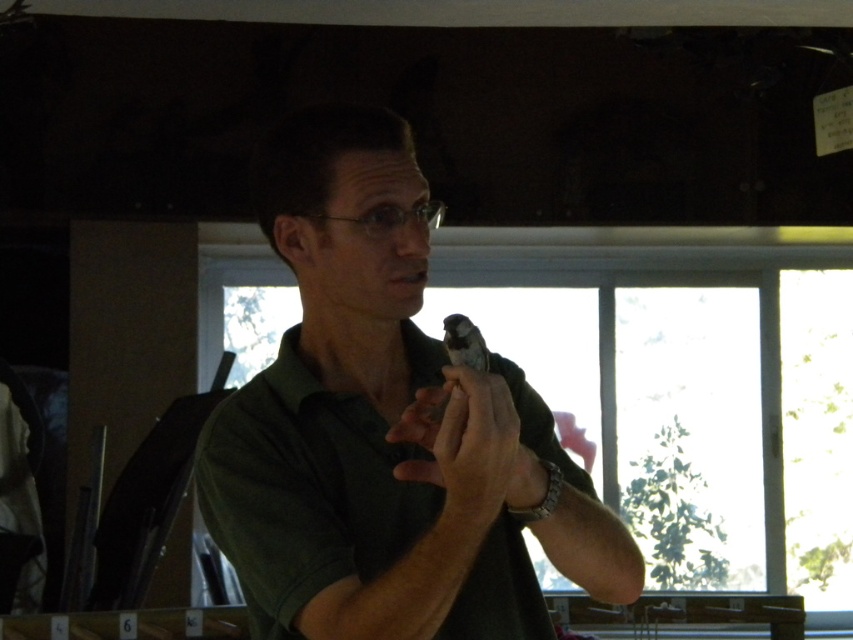
Does green matte shirt at center lie behind matte black object at center?

Yes, green matte shirt at center is behind matte black object at center.

I want to click on green matte shirt at center, so click(386, 428).

At what (x,y) coordinates should I click in order to perform the action: click on green matte shirt at center. Please return your answer as a coordinate pair (x, y). Image resolution: width=853 pixels, height=640 pixels. Looking at the image, I should click on (386, 428).